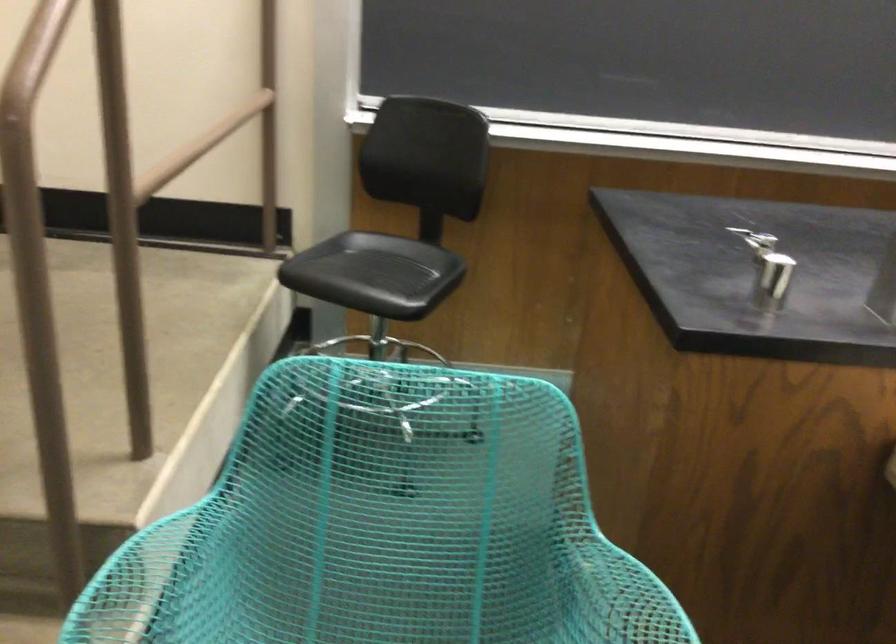
Find where to resting arm the turquoise chair armrest. Please return your answer as a coordinate pair (x, y).

(150, 582)